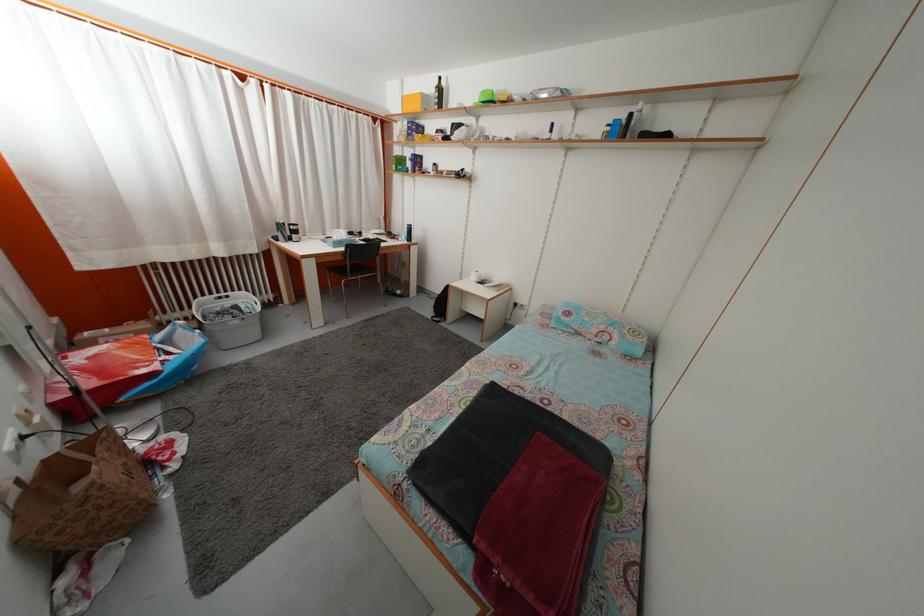
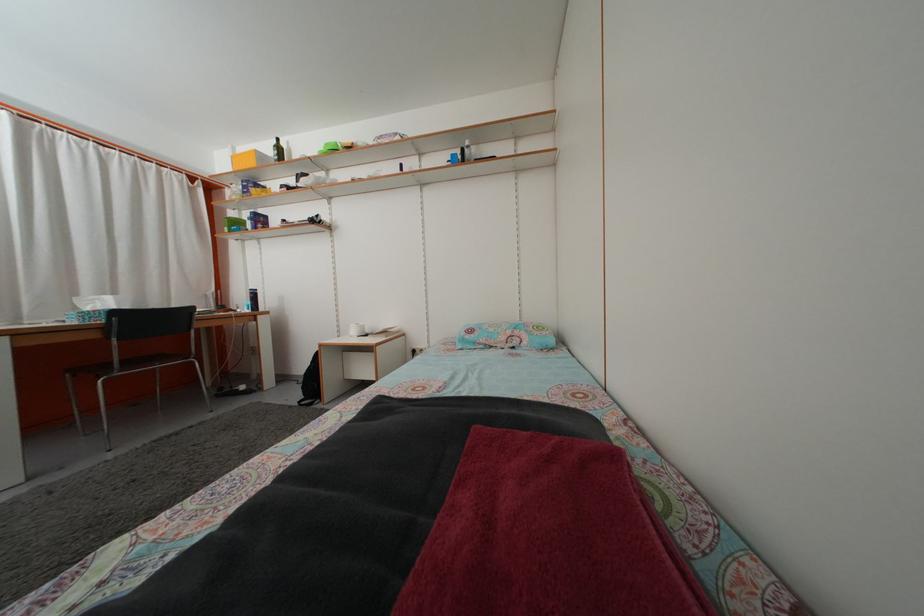
The point at (601, 339) is marked in the first image. Where is the corresponding point in the second image?

(508, 346)